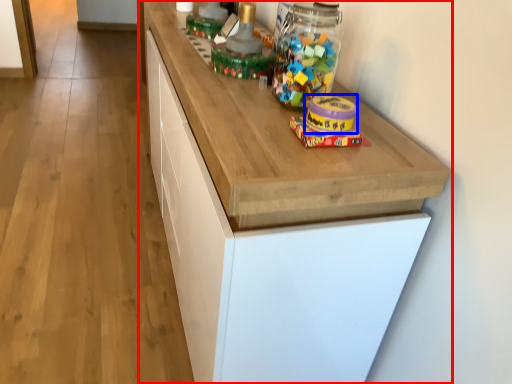
Question: Which of the following is the closest to the observer, cabinetry (highlighted by a red box) or toy (highlighted by a blue box)?

Choices:
 (A) cabinetry
 (B) toy

Answer: (A)